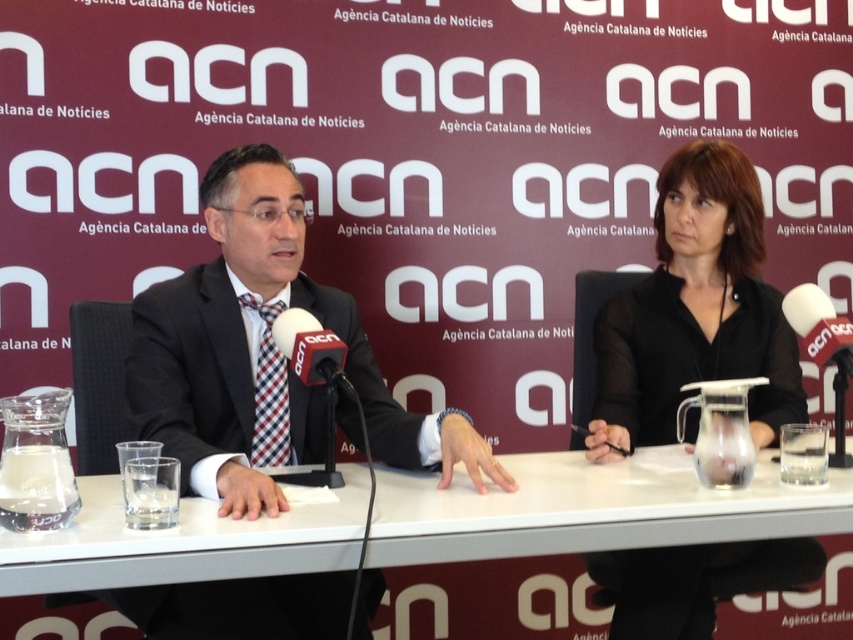
You are a photographer positioned behind the table. You need to adjust your camera to focus on both the white glossy table at center and the black matte shirt at center. Given their distance apart, will you need to adjust the focus for each separately?

The white glossy table at center and the black matte shirt at center are 15.93 inches apart from each other. Since they are at different distances from the camera, you will need to adjust the focus for each separately to ensure both are in sharp focus.

You are attending a press conference and notice the white glossy table at center and the black matte shirt at center. Which object occupies more horizontal space in the image?

The white glossy table at center has a greater width than the black matte shirt at center, so it occupies more horizontal space.